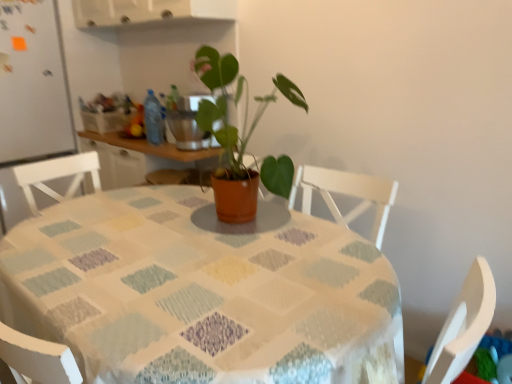
Find the location of a particular element. free region on the left part of matte terracotta pot at center is located at coordinates (152, 216).